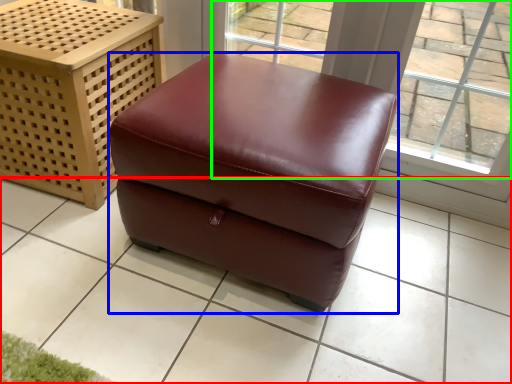
Question: Considering the real-world distances, which object is farthest from tile (highlighted by a red box)? furniture (highlighted by a blue box) or window (highlighted by a green box)?

Choices:
 (A) furniture
 (B) window

Answer: (B)